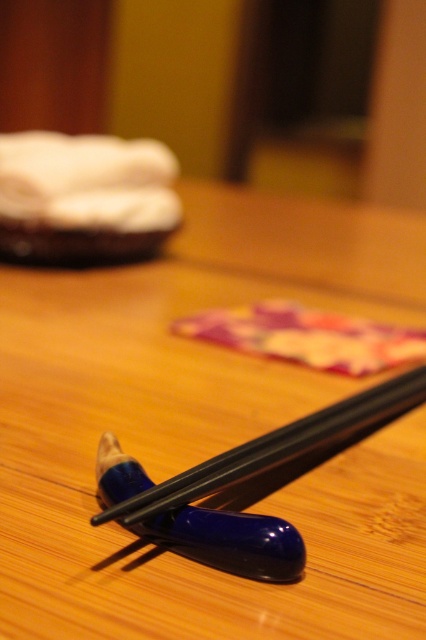
Question: Which point is farther to the camera?

Choices:
 (A) floral fabric at center
 (B) black glossy chopsticks at center
 (C) blue glossy chopsticks at center

Answer: (A)

Question: Which object is positioned closest to the blue glossy chopsticks at center?

Choices:
 (A) floral fabric at center
 (B) black glossy chopsticks at center

Answer: (A)

Question: Which object is the farthest from the blue glossy chopsticks at center?

Choices:
 (A) black glossy chopsticks at center
 (B) floral fabric at center

Answer: (A)

Question: Does floral fabric at center appear on the left side of blue glossy chopsticks at center?

Choices:
 (A) yes
 (B) no

Answer: (B)

Question: Can you confirm if black glossy chopsticks at center is wider than blue glossy chopsticks at center?

Choices:
 (A) yes
 (B) no

Answer: (A)

Question: Where is black glossy chopsticks at center located in relation to blue glossy chopsticks at center in the image?

Choices:
 (A) above
 (B) below

Answer: (A)